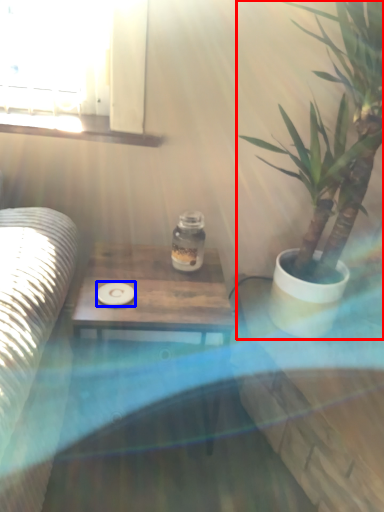
Question: Which object appears closest to the camera in this image, houseplant (highlighted by a red box) or coaster (highlighted by a blue box)?

Choices:
 (A) houseplant
 (B) coaster

Answer: (A)